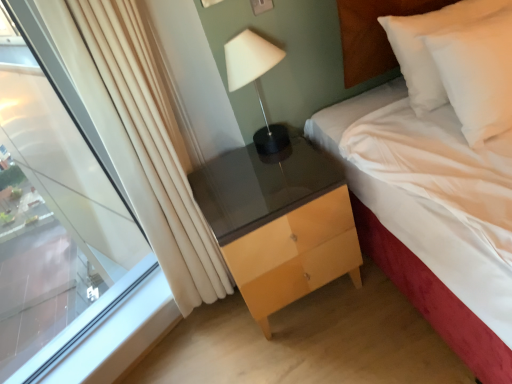
You are a GUI agent. You are given a task and a screenshot of the screen. Output one action in this format:
    pyautogui.click(x=<x>, y=<y>)
    Task: Click on the white soft pillow at upper right
    
    Given the screenshot: What is the action you would take?
    click(x=428, y=48)

What do you see at coordinates (65, 230) in the screenshot?
I see `transparent glass window at left` at bounding box center [65, 230].

Identify the location of white soft pillow at upper right. (428, 48).

Consider the image. From the image's perspective, would you say white soft bed at center is shown under matte wood chest of drawers at center?

No.

Is white soft bed at center taller or shorter than matte wood chest of drawers at center?

white soft bed at center is taller than matte wood chest of drawers at center.

Is white soft bed at center next to matte wood chest of drawers at center and touching it?

white soft bed at center and matte wood chest of drawers at center are not in contact.

Consider the image. Do you think white soft bed at center is within matte wood chest of drawers at center, or outside of it?

The correct answer is: outside.

Does transparent glass window at left come behind matte wood chest of drawers at center?

No, it is not.

What's the angular difference between transparent glass window at left and matte wood chest of drawers at center's facing directions?

The facing directions of transparent glass window at left and matte wood chest of drawers at center are 28.3 degrees apart.

From the image's perspective, is transparent glass window at left below matte wood chest of drawers at center?

Incorrect, from the image's perspective, transparent glass window at left is higher than matte wood chest of drawers at center.

Considering the relative positions of transparent glass window at left and matte wood chest of drawers at center in the image provided, is transparent glass window at left to the right of matte wood chest of drawers at center from the viewer's perspective?

No, transparent glass window at left is not to the right of matte wood chest of drawers at center.

Does white soft pillow at upper right have a lesser height compared to matte wood chest of drawers at center?

In fact, white soft pillow at upper right may be taller than matte wood chest of drawers at center.

Looking at the image, does white soft pillow at upper right seem bigger or smaller compared to matte wood chest of drawers at center?

Clearly, white soft pillow at upper right is smaller in size than matte wood chest of drawers at center.

Is matte wood chest of drawers at center a part of white soft pillow at upper right?

No, matte wood chest of drawers at center is not a part of white soft pillow at upper right.

Is white soft pillow at upper right oriented towards matte wood chest of drawers at center?

No.

Between white soft bed at center and white soft pillow at upper right, which one has smaller size?

white soft pillow at upper right.

Considering the sizes of white soft bed at center and white soft pillow at upper right in the image, is white soft bed at center taller or shorter than white soft pillow at upper right?

In the image, white soft bed at center appears to be taller than white soft pillow at upper right.

Is white soft bed at center inside the boundaries of white soft pillow at upper right, or outside?

white soft bed at center lies outside white soft pillow at upper right.

How different are the orientations of white soft bed at center and white soft pillow at upper right in degrees?

The angular difference between white soft bed at center and white soft pillow at upper right is 1.35 degrees.

Between transparent glass window at left and white soft pillow at upper right, which one appears on the right side from the viewer's perspective?

white soft pillow at upper right.

Is transparent glass window at left inside or outside of white soft pillow at upper right?

transparent glass window at left is not inside white soft pillow at upper right, it's outside.

Identify the location of window lying below the white soft pillow at upper right (from the image's perspective). (65, 230).

Would you say transparent glass window at left is inside or outside matte black lamp at upper center?

transparent glass window at left is spatially situated outside matte black lamp at upper center.

Is transparent glass window at left in contact with matte black lamp at upper center?

No, transparent glass window at left is not beside matte black lamp at upper center.

How many degrees apart are the facing directions of transparent glass window at left and matte black lamp at upper center?

They differ by 30.8 degrees in their facing directions.

Is transparent glass window at left looking in the opposite direction of matte black lamp at upper center?

transparent glass window at left is not turned away from matte black lamp at upper center.

Which point is more distant from viewer, [271,57] or [409,17]?

Point [271,57]

Which is more to the right, matte black lamp at upper center or white soft pillow at upper right?

Positioned to the right is white soft pillow at upper right.

How different are the orientations of matte black lamp at upper center and white soft pillow at upper right in degrees?

They differ by 0.435 degrees in their facing directions.

From the image's perspective, is matte black lamp at upper center over white soft pillow at upper right?

No, from the image's perspective, matte black lamp at upper center is not over white soft pillow at upper right.

The width and height of the screenshot is (512, 384). Find the location of `the chest of drawers directly beneath the white soft bed at center (from a real-world perspective)`. the chest of drawers directly beneath the white soft bed at center (from a real-world perspective) is located at coordinates (295, 255).

Where is `window lying in front of the matte wood chest of drawers at center`? This screenshot has width=512, height=384. window lying in front of the matte wood chest of drawers at center is located at coordinates (65, 230).

When comparing their distances from matte wood chest of drawers at center, does white soft bed at center or matte black lamp at upper center seem further?

matte black lamp at upper center is positioned further to the anchor matte wood chest of drawers at center.

Which object lies nearer to the anchor point white soft pillow at upper right, matte black lamp at upper center or transparent glass window at left?

Among the two, matte black lamp at upper center is located nearer to white soft pillow at upper right.

From the image, which object appears to be farther from transparent glass window at left, matte black lamp at upper center or matte wood chest of drawers at center?

The object further to transparent glass window at left is matte black lamp at upper center.

From the image, which object appears to be nearer to white soft pillow at upper right, transparent glass window at left or matte wood chest of drawers at center?

Based on the image, matte wood chest of drawers at center appears to be nearer to white soft pillow at upper right.

Looking at the image, which one is located closer to white soft bed at center, matte wood chest of drawers at center or transparent glass window at left?

Based on the image, matte wood chest of drawers at center appears to be nearer to white soft bed at center.

Based on their spatial positions, is matte black lamp at upper center or white soft pillow at upper right closer to white soft bed at center?

The object closer to white soft bed at center is white soft pillow at upper right.

Considering their positions, is white soft pillow at upper right positioned closer to transparent glass window at left than matte wood chest of drawers at center?

matte wood chest of drawers at center is positioned closer to the anchor transparent glass window at left.

From the image, which object appears to be farther from matte black lamp at upper center, white soft pillow at upper right or transparent glass window at left?

transparent glass window at left is further to matte black lamp at upper center.

Image resolution: width=512 pixels, height=384 pixels. What are the coordinates of `bedside lamp situated between transparent glass window at left and matte wood chest of drawers at center from left to right` in the screenshot? It's located at (255, 82).

At what (x,y) coordinates should I click in order to perform the action: click on chest of drawers between transparent glass window at left and white soft pillow at upper right. Please return your answer as a coordinate pair (x, y). This screenshot has height=384, width=512. Looking at the image, I should click on (295, 255).

At what (x,y) coordinates should I click in order to perform the action: click on pillow located between transparent glass window at left and white soft bed at center in the left-right direction. Please return your answer as a coordinate pair (x, y). The height and width of the screenshot is (384, 512). Looking at the image, I should click on (428, 48).

The height and width of the screenshot is (384, 512). In order to click on chest of drawers between matte black lamp at upper center and white soft bed at center in this screenshot , I will do `click(295, 255)`.